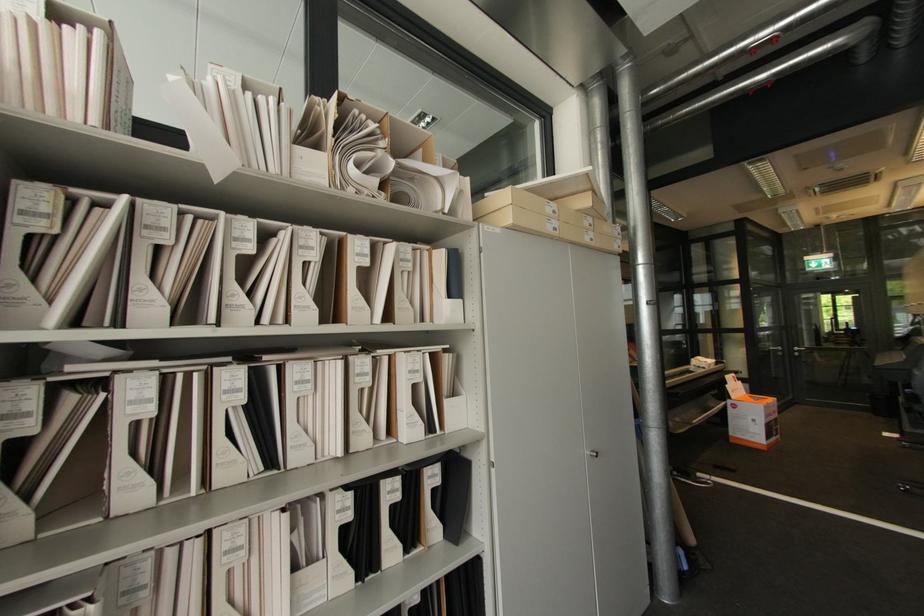
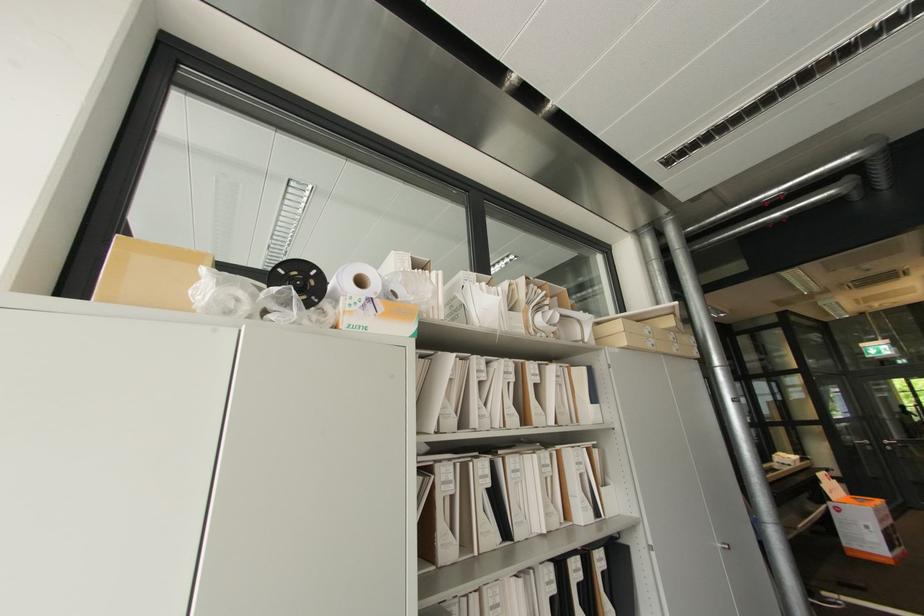
Question: How did the camera likely rotate?

Choices:
 (A) Left
 (B) Right
 (C) Up
 (D) Down

Answer: (C)